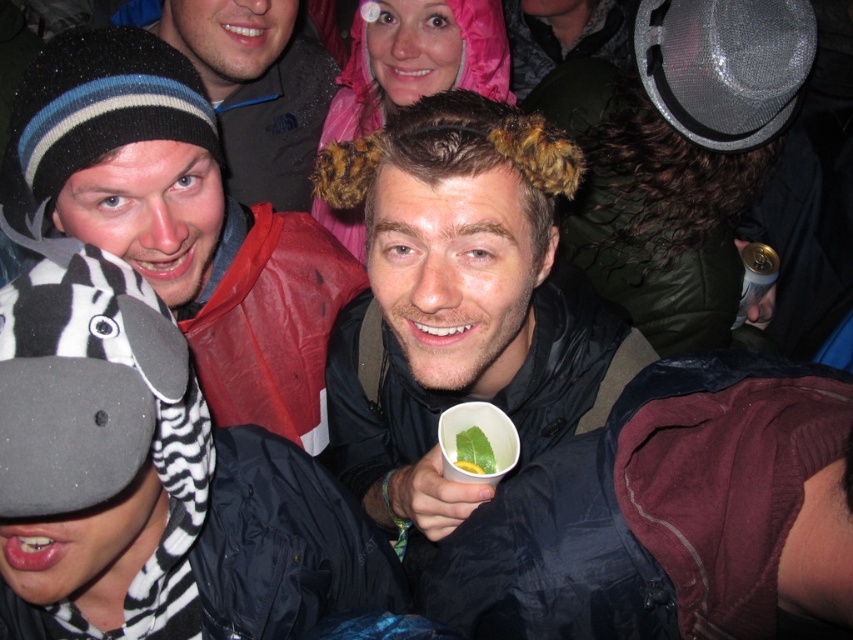
Question: Which of the following is the farthest from the observer?

Choices:
 (A) zebra-patterned plush toy at left
 (B) gold metallic can at upper right

Answer: (B)

Question: Which object is positioned closest to the fuzzy brown hat at center?

Choices:
 (A) matte black jacket at upper left
 (B) zebra-patterned plush toy at left

Answer: (B)

Question: Which point is closer to the camera?

Choices:
 (A) matte black jacket at upper left
 (B) gold metallic can at upper right
 (C) green leafy vegetable at center
 (D) zebra-patterned plush toy at left

Answer: (D)

Question: From the image, what is the correct spatial relationship of gold metallic can at upper right in relation to green leafy vegetable at center?

Choices:
 (A) above
 (B) below

Answer: (A)

Question: Is zebra-patterned plush toy at left below matte black jacket at upper left?

Choices:
 (A) yes
 (B) no

Answer: (A)

Question: Can you confirm if zebra-patterned plush toy at left is smaller than green leafy vegetable at center?

Choices:
 (A) no
 (B) yes

Answer: (A)